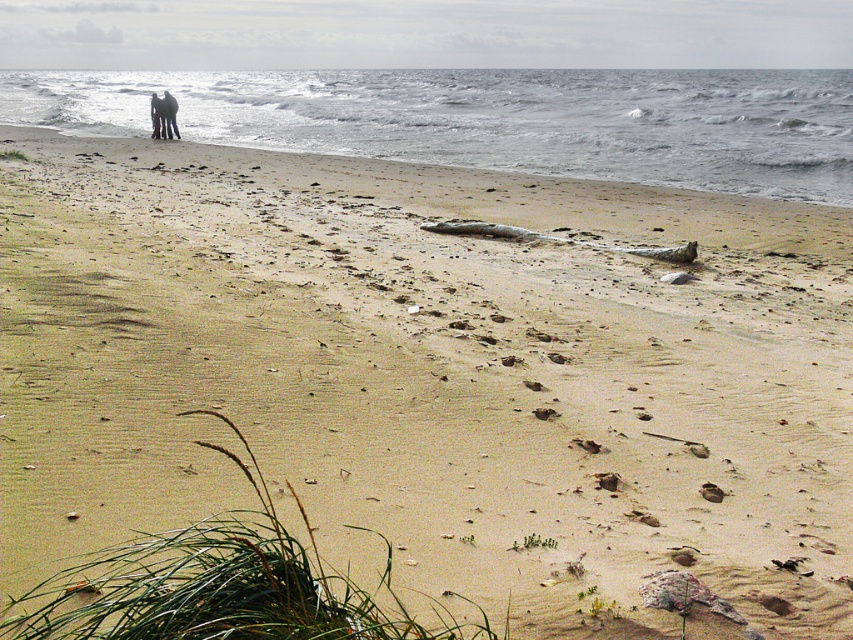
Question: Which object appears farthest from the camera in this image?

Choices:
 (A) dark gray fabric pants at upper left
 (B) dark clothing couple at upper left
 (C) gray water at upper left

Answer: (A)

Question: Does gray water at upper left appear under dark clothing couple at upper left?

Choices:
 (A) yes
 (B) no

Answer: (B)

Question: Is the position of dark clothing couple at upper left more distant than that of dark gray fabric pants at upper left?

Choices:
 (A) no
 (B) yes

Answer: (A)

Question: Which point is closer to the camera?

Choices:
 (A) (154, 125)
 (B) (177, 125)

Answer: (B)

Question: Observing the image, what is the correct spatial positioning of gray water at upper left in reference to dark clothing couple at upper left?

Choices:
 (A) below
 (B) above

Answer: (B)

Question: Considering the real-world distances, which object is closest to the dark clothing couple at upper left?

Choices:
 (A) gray water at upper left
 (B) dark gray fabric pants at upper left

Answer: (B)